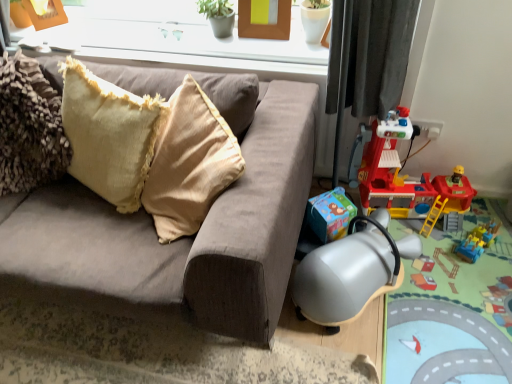
Question: Considering the relative sizes of beige textured pillow at upper left and metallic plastic playset at lower right in the image provided, is beige textured pillow at upper left thinner than metallic plastic playset at lower right?

Choices:
 (A) yes
 (B) no

Answer: (A)

Question: Is beige textured pillow at upper left at the left side of metallic plastic playset at lower right?

Choices:
 (A) yes
 (B) no

Answer: (A)

Question: Is beige textured pillow at upper left not close to metallic plastic playset at lower right?

Choices:
 (A) yes
 (B) no

Answer: (A)

Question: Is beige textured pillow at upper left oriented towards metallic plastic playset at lower right?

Choices:
 (A) no
 (B) yes

Answer: (A)

Question: Is metallic plastic playset at lower right surrounded by beige textured pillow at upper left?

Choices:
 (A) yes
 (B) no

Answer: (B)

Question: From a real-world perspective, is beige textured pillow at upper left located beneath metallic plastic playset at lower right?

Choices:
 (A) yes
 (B) no

Answer: (B)

Question: Is plastic red fire station at right, positioned as the second toy in bottom-to-top order, at the right side of brown wooden picture frame at upper center?

Choices:
 (A) yes
 (B) no

Answer: (A)

Question: Considering the relative positions of plastic red fire station at right, which ranks as the first toy in top-to-bottom order, and brown wooden picture frame at upper center in the image provided, is plastic red fire station at right, which ranks as the first toy in top-to-bottom order, to the left of brown wooden picture frame at upper center from the viewer's perspective?

Choices:
 (A) yes
 (B) no

Answer: (B)

Question: Does plastic red fire station at right, positioned as the second toy in bottom-to-top order, lie in front of brown wooden picture frame at upper center?

Choices:
 (A) no
 (B) yes

Answer: (B)

Question: Is brown wooden picture frame at upper center located within plastic red fire station at right, which ranks as the first toy in top-to-bottom order?

Choices:
 (A) yes
 (B) no

Answer: (B)

Question: Considering the relative sizes of plastic red fire station at right, which ranks as the first toy in top-to-bottom order, and brown wooden picture frame at upper center in the image provided, is plastic red fire station at right, which ranks as the first toy in top-to-bottom order, shorter than brown wooden picture frame at upper center?

Choices:
 (A) yes
 (B) no

Answer: (B)

Question: From a real-world perspective, is plastic red fire station at right, positioned as the second toy in bottom-to-top order, located higher than brown wooden picture frame at upper center?

Choices:
 (A) yes
 (B) no

Answer: (B)

Question: Is plastic red fire station at right, which ranks as the first toy in top-to-bottom order, not inside beige textured pillow at upper left?

Choices:
 (A) no
 (B) yes

Answer: (B)